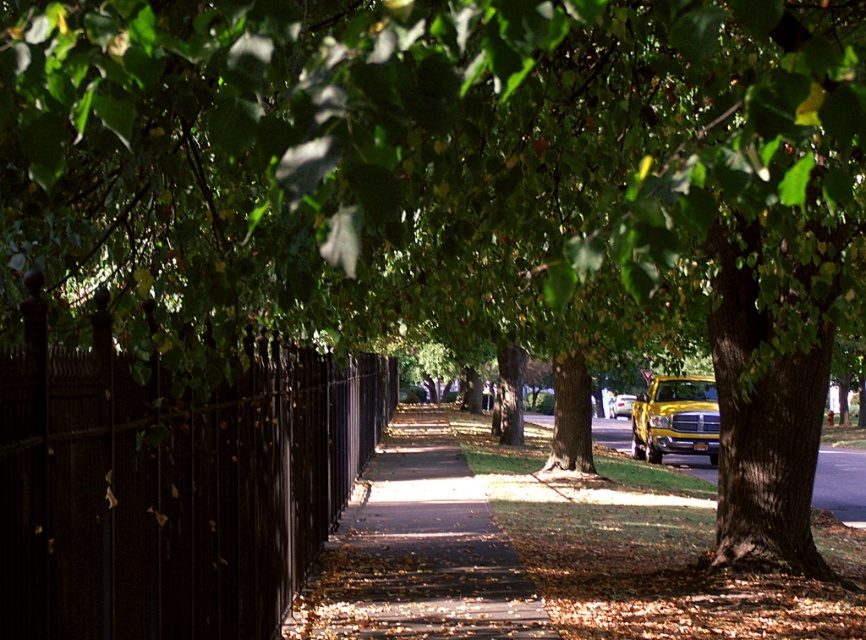
Question: Does brown concrete sidewalk at center appear under yellow matte truck at center?

Choices:
 (A) yes
 (B) no

Answer: (B)

Question: Which object is closer to the camera taking this photo?

Choices:
 (A) black wrought iron fence at left
 (B) yellow metallic truck at center
 (C) yellow matte truck at center

Answer: (A)

Question: Does black wrought iron fence at left have a greater width compared to yellow matte truck at right?

Choices:
 (A) yes
 (B) no

Answer: (B)

Question: Does black wrought iron fence at left have a larger size compared to yellow matte truck at right?

Choices:
 (A) yes
 (B) no

Answer: (A)

Question: Which object is farther from the camera taking this photo?

Choices:
 (A) brown concrete sidewalk at center
 (B) yellow matte truck at center
 (C) black wrought iron fence at left

Answer: (B)

Question: Estimate the real-world distances between objects in this image. Which object is closer to the yellow metallic truck at center?

Choices:
 (A) black wrought iron fence at left
 (B) yellow matte truck at right
 (C) yellow matte truck at center

Answer: (C)